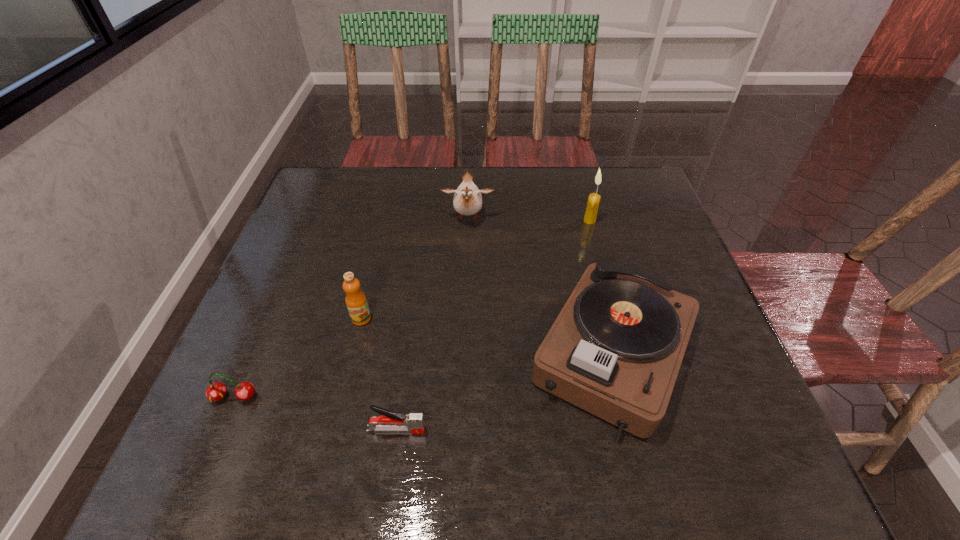
Find the location of a particular element. This screenshot has width=960, height=540. candle is located at coordinates (593, 202).

Where is `bird`? The width and height of the screenshot is (960, 540). bird is located at coordinates (467, 200).

Find the location of `orange juice`. orange juice is located at coordinates (356, 302).

Where is `record player`? Image resolution: width=960 pixels, height=540 pixels. record player is located at coordinates (615, 349).

Where is `stapler`? stapler is located at coordinates (390, 421).

Where is `cherry`? cherry is located at coordinates (216, 391).

At what (x,y) coordinates should I click in order to perform the action: click on vacant region located 0.180m on the back of the tallest object. Please return your answer as a coordinate pair (x, y). The height and width of the screenshot is (540, 960). Looking at the image, I should click on (579, 180).

Where is `vacant space located at the beak of the bird`? vacant space located at the beak of the bird is located at coordinates coord(466,290).

What are the coordinates of `vacant space located 0.220m on the front label of the orange juice` in the screenshot? It's located at (337, 422).

Locate an element on the screen. Image resolution: width=960 pixels, height=540 pixels. vacant space located on the back of the record player is located at coordinates (582, 226).